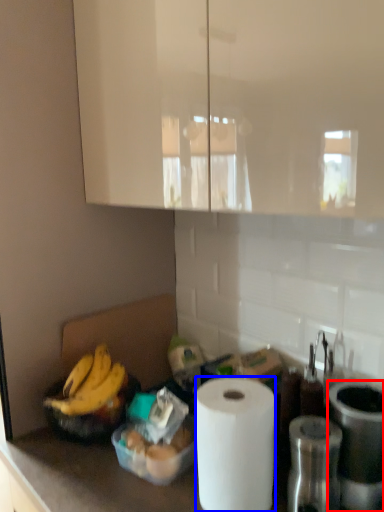
Question: Among these objects, which one is nearest to the camera, appliance (highlighted by a red box) or paper towel (highlighted by a blue box)?

Choices:
 (A) appliance
 (B) paper towel

Answer: (B)